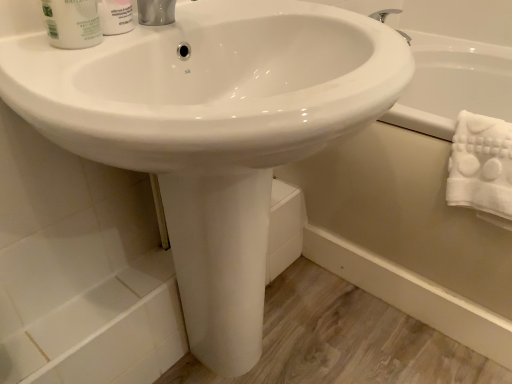
Question: Is white fluffy towel at right bigger than white glossy bathtub at lower right?

Choices:
 (A) yes
 (B) no

Answer: (B)

Question: Is white fluffy towel at right shorter than white glossy bathtub at lower right?

Choices:
 (A) yes
 (B) no

Answer: (A)

Question: Is white glossy bathtub at lower right at the back of white fluffy towel at right?

Choices:
 (A) no
 (B) yes

Answer: (B)

Question: Does white fluffy towel at right appear on the right side of white glossy bathtub at lower right?

Choices:
 (A) no
 (B) yes

Answer: (A)

Question: From the image's perspective, is white fluffy towel at right over white glossy bathtub at lower right?

Choices:
 (A) yes
 (B) no

Answer: (B)

Question: Is white fluffy towel at right to the left or to the right of white glossy mouthwash at upper left in the image?

Choices:
 (A) right
 (B) left

Answer: (A)

Question: From the image's perspective, is white fluffy towel at right above or below white glossy mouthwash at upper left?

Choices:
 (A) above
 (B) below

Answer: (B)

Question: Relative to white glossy mouthwash at upper left, is white fluffy towel at right in front or behind?

Choices:
 (A) behind
 (B) front

Answer: (A)

Question: From a real-world perspective, relative to white glossy mouthwash at upper left, is white fluffy towel at right vertically above or below?

Choices:
 (A) above
 (B) below

Answer: (B)

Question: In terms of width, does white glossy mouthwash at upper left look wider or thinner when compared to white fluffy towel at right?

Choices:
 (A) thin
 (B) wide

Answer: (A)

Question: Is white glossy mouthwash at upper left inside or outside of white fluffy towel at right?

Choices:
 (A) outside
 (B) inside

Answer: (A)

Question: Is point (81, 11) closer or farther from the camera than point (461, 130)?

Choices:
 (A) closer
 (B) farther

Answer: (A)

Question: From a real-world perspective, is white glossy mouthwash at upper left positioned above or below white fluffy towel at right?

Choices:
 (A) below
 (B) above

Answer: (B)

Question: Considering the positions of white matte shaving cream at upper left and white glossy bathtub at lower right in the image, is white matte shaving cream at upper left wider or thinner than white glossy bathtub at lower right?

Choices:
 (A) thin
 (B) wide

Answer: (A)

Question: Looking at the image, does white matte shaving cream at upper left seem bigger or smaller compared to white glossy bathtub at lower right?

Choices:
 (A) small
 (B) big

Answer: (A)